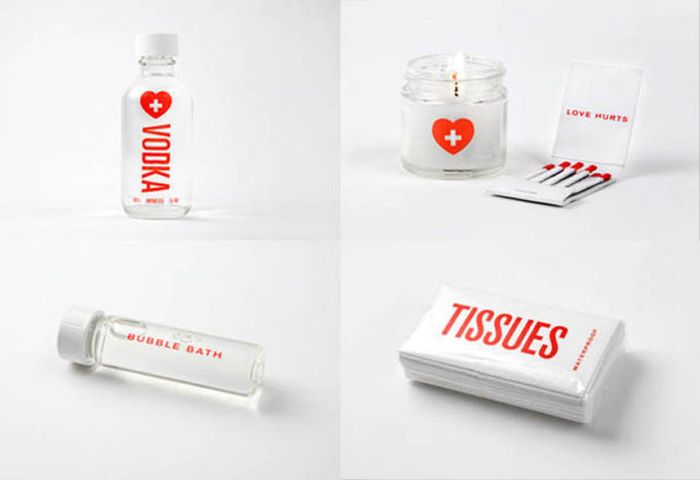
At what (x,y) coordinates should I click in order to perform the action: click on bubble bath. Please return your answer as a coordinate pair (x, y). The height and width of the screenshot is (480, 700). Looking at the image, I should click on (169, 345).